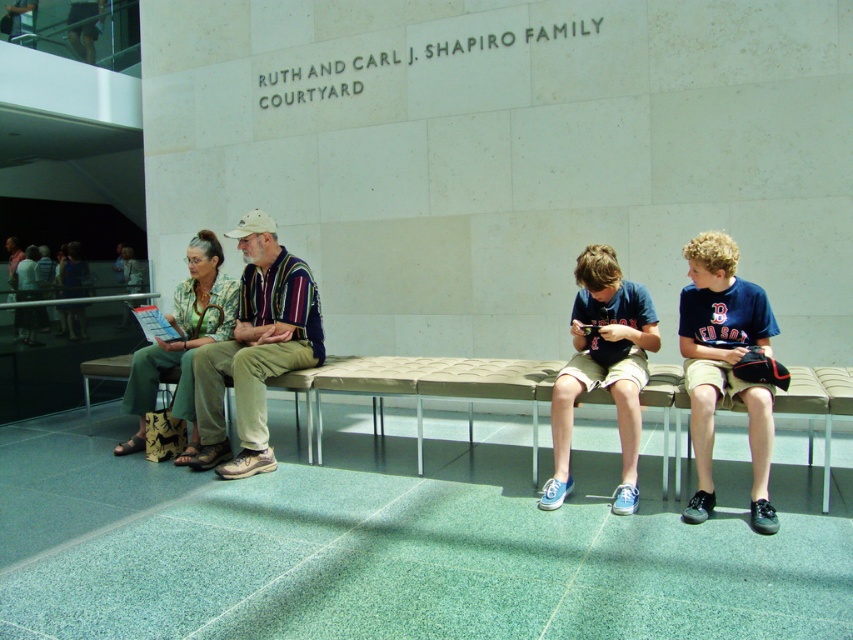
Who is positioned more to the left, beige quilted fabric bench at center or striped cotton shirt at center?

striped cotton shirt at center

Between beige quilted fabric bench at center and striped cotton shirt at center, which one has more height?

striped cotton shirt at center is taller.

The height and width of the screenshot is (640, 853). What do you see at coordinates (416, 388) in the screenshot?
I see `beige quilted fabric bench at center` at bounding box center [416, 388].

Where is `beige quilted fabric bench at center`? This screenshot has width=853, height=640. beige quilted fabric bench at center is located at coordinates (416, 388).

Consider the image. How much distance is there between blue cotton shirt at right and blue canvas sneakers at center?

blue cotton shirt at right is 13.97 inches from blue canvas sneakers at center.

Is blue cotton shirt at right behind blue canvas sneakers at center?

No, it is in front of blue canvas sneakers at center.

Between point (721, 349) and point (640, 349), which one is positioned behind?

The point (640, 349) is more distant.

Find the location of a particular element. The image size is (853, 640). blue cotton shirt at right is located at coordinates (724, 365).

In the scene shown: Is striped cotton shirt at center taller than blue cotton shirt at right?

Correct, striped cotton shirt at center is much taller as blue cotton shirt at right.

At what (x,y) coordinates should I click in order to perform the action: click on striped cotton shirt at center. Please return your answer as a coordinate pair (x, y). Looking at the image, I should click on (254, 349).

Locate an element on the screen. striped cotton shirt at center is located at coordinates (254, 349).